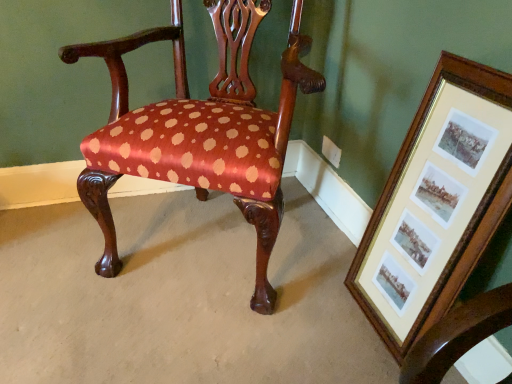
Question: In the image, is satin-polka dot chair at center on the left side or the right side of wooden framed prints at right?

Choices:
 (A) right
 (B) left

Answer: (B)

Question: From a real-world perspective, is satin-polka dot chair at center physically located above or below wooden framed prints at right?

Choices:
 (A) below
 (B) above

Answer: (B)

Question: Is satin-polka dot chair at center in front of or behind wooden framed prints at right in the image?

Choices:
 (A) front
 (B) behind

Answer: (B)

Question: Is wooden framed prints at right taller or shorter than satin-polka dot chair at center?

Choices:
 (A) short
 (B) tall

Answer: (A)

Question: Is wooden framed prints at right inside or outside of satin-polka dot chair at center?

Choices:
 (A) outside
 (B) inside

Answer: (A)

Question: Considering the positions of wooden framed prints at right and satin-polka dot chair at center in the image, is wooden framed prints at right bigger or smaller than satin-polka dot chair at center?

Choices:
 (A) big
 (B) small

Answer: (B)

Question: Considering the positions of wooden framed prints at right and satin-polka dot chair at center in the image, is wooden framed prints at right wider or thinner than satin-polka dot chair at center?

Choices:
 (A) wide
 (B) thin

Answer: (B)